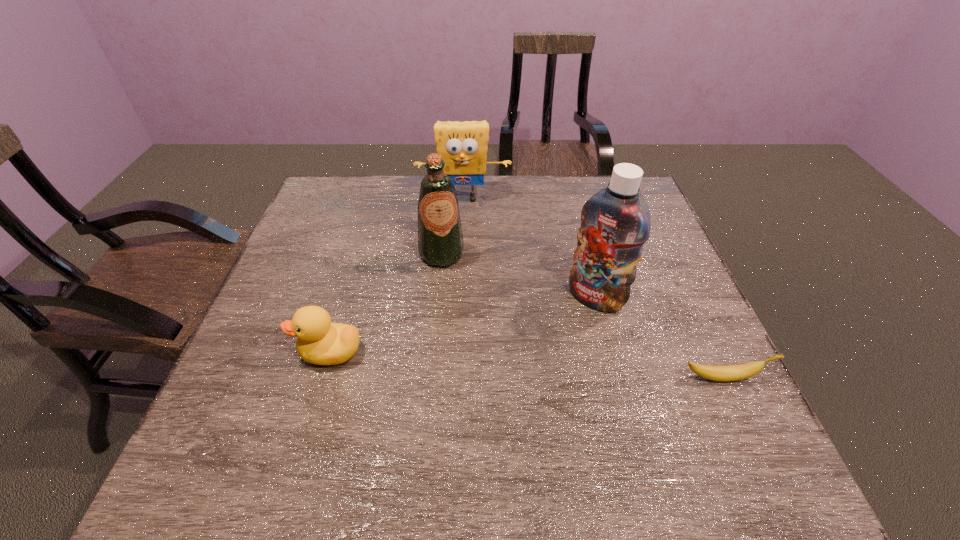
The width and height of the screenshot is (960, 540). In order to click on free spot on the desktop that is between the fourth farthest object and the nearest object and is positioned on the front label of the shampoo in this screenshot , I will do `click(541, 366)`.

Identify the location of free spot on the desktop that is between the fourth tallest object and the nearest object and is positioned on the face of the sponge. (464, 361).

Where is `vacant space on the desktop that is between the second shortest object and the nearest object and is positioned on the front-facing side of the olive oil`? The width and height of the screenshot is (960, 540). vacant space on the desktop that is between the second shortest object and the nearest object and is positioned on the front-facing side of the olive oil is located at coordinates (475, 361).